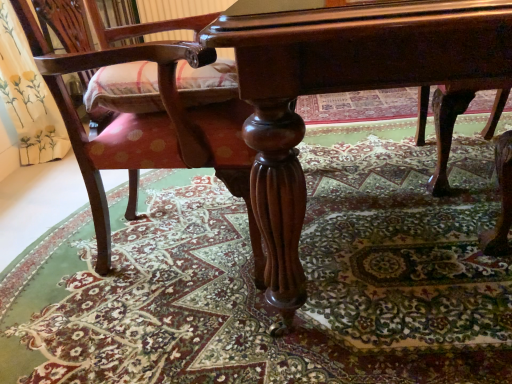
Question: Are polished dark wood table at center and carpeted floor at center far apart?

Choices:
 (A) no
 (B) yes

Answer: (A)

Question: From the image's perspective, is polished dark wood table at center below carpeted floor at center?

Choices:
 (A) yes
 (B) no

Answer: (B)

Question: Is polished dark wood table at center to the left of carpeted floor at center from the viewer's perspective?

Choices:
 (A) no
 (B) yes

Answer: (A)

Question: Is polished dark wood table at center not within carpeted floor at center?

Choices:
 (A) no
 (B) yes

Answer: (B)

Question: Considering the relative sizes of polished dark wood table at center and carpeted floor at center in the image provided, is polished dark wood table at center taller than carpeted floor at center?

Choices:
 (A) yes
 (B) no

Answer: (A)

Question: Looking at their shapes, would you say carpeted floor at center is wider or thinner than polished wood chair at lower left?

Choices:
 (A) wide
 (B) thin

Answer: (A)

Question: Is carpeted floor at center situated inside polished wood chair at lower left or outside?

Choices:
 (A) outside
 (B) inside

Answer: (A)

Question: In the image, is carpeted floor at center on the left side or the right side of polished wood chair at lower left?

Choices:
 (A) right
 (B) left

Answer: (A)

Question: Based on their sizes in the image, would you say carpeted floor at center is bigger or smaller than polished wood chair at lower left?

Choices:
 (A) big
 (B) small

Answer: (B)

Question: Considering their positions, is polished dark wood table at center located in front of or behind carpeted floor at center?

Choices:
 (A) front
 (B) behind

Answer: (A)

Question: Is point (239, 13) closer or farther from the camera than point (265, 365)?

Choices:
 (A) farther
 (B) closer

Answer: (B)

Question: Would you say polished dark wood table at center is to the left or to the right of carpeted floor at center in the picture?

Choices:
 (A) right
 (B) left

Answer: (A)

Question: Looking at their shapes, would you say polished dark wood table at center is wider or thinner than carpeted floor at center?

Choices:
 (A) thin
 (B) wide

Answer: (A)

Question: Which is correct: polished dark wood table at center is inside polished wood chair at lower left, or outside of it?

Choices:
 (A) inside
 (B) outside

Answer: (B)

Question: Relative to polished wood chair at lower left, is polished dark wood table at center in front or behind?

Choices:
 (A) front
 (B) behind

Answer: (A)